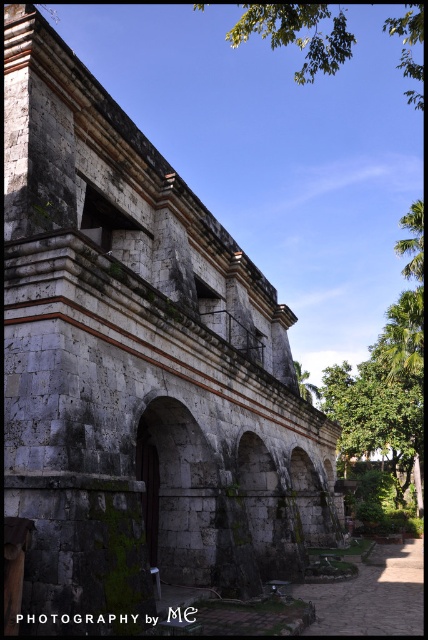
Question: Considering the real-world distances, which object is farthest from the green leafy tree at upper center?

Choices:
 (A) gray stone archway at center
 (B) green leafy tree at upper right
 (C) green leafy tree at right

Answer: (C)

Question: Which point is closer to the camera?

Choices:
 (A) green leafy tree at upper right
 (B) gray stone archway at center

Answer: (B)

Question: Does green leafy tree at upper center have a larger size compared to green leafy tree at upper right?

Choices:
 (A) no
 (B) yes

Answer: (B)

Question: Does green leafy tree at upper center appear over green leafy tree at upper right?

Choices:
 (A) no
 (B) yes

Answer: (B)

Question: Which point is farther from the camera taking this photo?

Choices:
 (A) (193, 561)
 (B) (395, 465)
 (C) (416, 246)

Answer: (B)

Question: Does gray stone archway at center have a smaller size compared to green leafy tree at upper center?

Choices:
 (A) yes
 (B) no

Answer: (A)